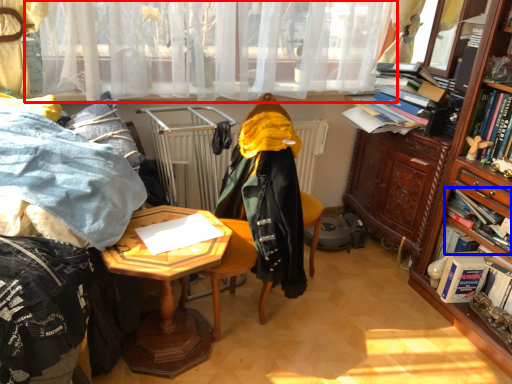
Question: Among these objects, which one is farthest to the camera, curtain (highlighted by a red box) or book (highlighted by a blue box)?

Choices:
 (A) curtain
 (B) book

Answer: (B)